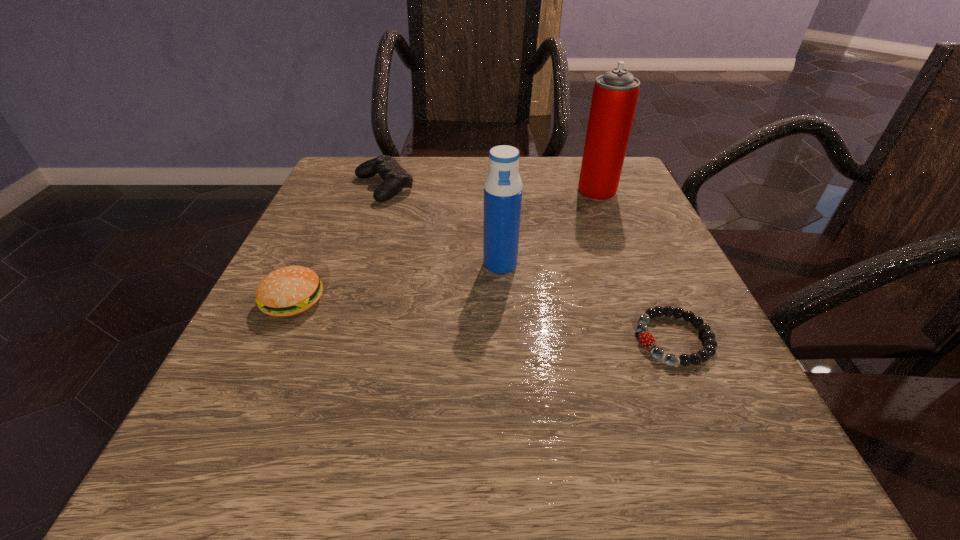
Locate an element on the screen. Image resolution: width=960 pixels, height=540 pixels. aerosol can is located at coordinates (615, 94).

I want to click on water bottle, so click(x=503, y=187).

Where is `the third nearest object`? The image size is (960, 540). the third nearest object is located at coordinates (503, 187).

Where is `control`? The height and width of the screenshot is (540, 960). control is located at coordinates (395, 178).

Where is `patty`? The width and height of the screenshot is (960, 540). patty is located at coordinates (287, 291).

At what (x,y) coordinates should I click in order to perform the action: click on bracelet. Please return your answer as a coordinate pair (x, y). Looking at the image, I should click on (646, 339).

Where is `vacant space situated 0.070m on the front of the aerosol can`? vacant space situated 0.070m on the front of the aerosol can is located at coordinates coord(608,220).

I want to click on vacant position located 0.170m on the left of the third nearest object, so click(x=388, y=264).

At what (x,y) coordinates should I click in order to perform the action: click on vacant space positioned on the right of the control. Please return your answer as a coordinate pair (x, y). Image resolution: width=960 pixels, height=540 pixels. Looking at the image, I should click on (491, 187).

You are a GUI agent. You are given a task and a screenshot of the screen. Output one action in this format:
    pyautogui.click(x=<x>, y=<y>)
    Task: Click on the vacant position located 0.090m on the right of the patty
    
    Given the screenshot: What is the action you would take?
    pyautogui.click(x=380, y=300)